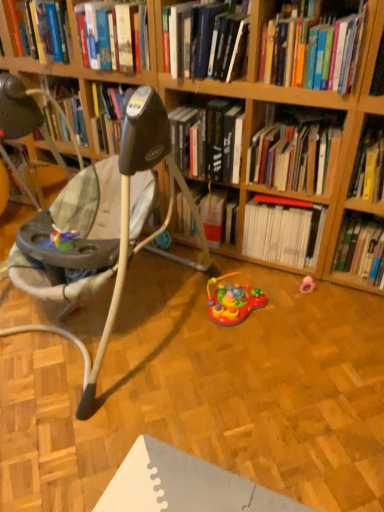
This screenshot has height=512, width=384. I want to click on free space to the back side of multicolored plastic toy at center, the 1th toy viewed from the left, so click(x=231, y=271).